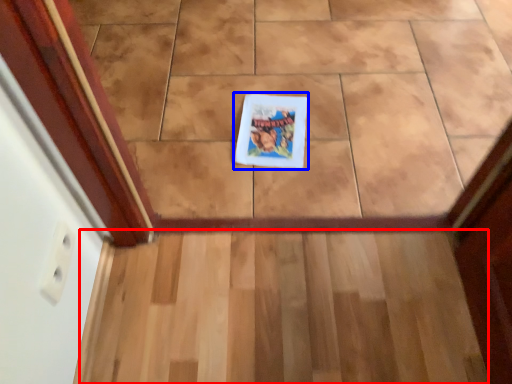
Question: Which of the following is the closest to the observer, stairs (highlighted by a red box) or book cover (highlighted by a blue box)?

Choices:
 (A) stairs
 (B) book cover

Answer: (A)